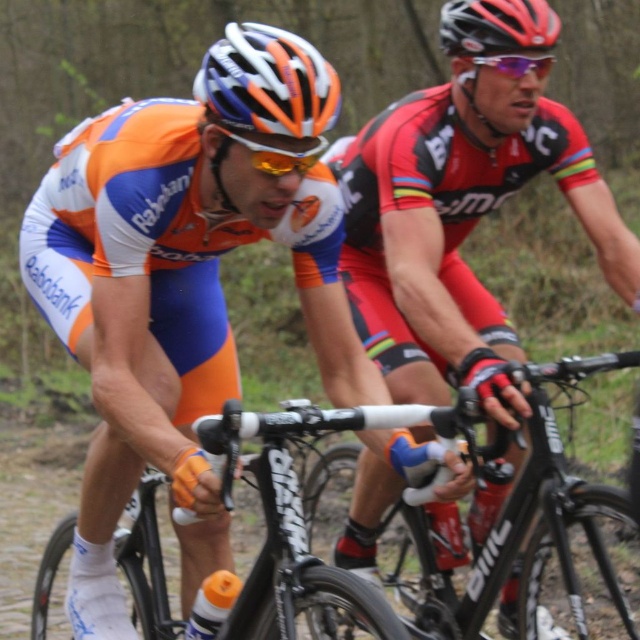
You are a photographer positioned at the starting line of a cycling race. You want to capture a photo of the black matte bicycle at center and the white matte bicycle handlebars at center. Based on their positions, which object should you frame first in your camera viewfinder to ensure both are in the shot?

The white matte bicycle handlebars at center should be framed first since the black matte bicycle at center is positioned to the right of it, meaning the handlebars are closer to the left side of the frame. By starting with the handlebars, you can then adjust to include the bicycle to the right.